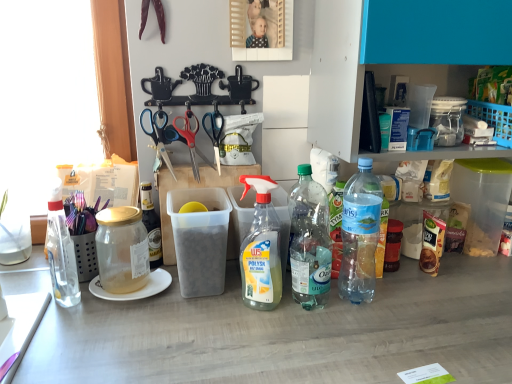
Question: Is clear plastic bottle at center, which appears as the 3th bottle when viewed from the right, in contact with red plastic scissors at center, which is the 2th scissors from right to left?

Choices:
 (A) no
 (B) yes

Answer: (A)

Question: Is clear plastic bottle at center, the 3th bottle in the left-to-right sequence, shorter than red plastic scissors at center, which is the second scissors from left to right?

Choices:
 (A) no
 (B) yes

Answer: (A)

Question: Considering the relative sizes of clear plastic bottle at center, the 3th bottle in the left-to-right sequence, and red plastic scissors at center, which is the 2th scissors from right to left, in the image provided, is clear plastic bottle at center, the 3th bottle in the left-to-right sequence, taller than red plastic scissors at center, which is the 2th scissors from right to left,?

Choices:
 (A) no
 (B) yes

Answer: (B)

Question: Are clear plastic bottle at center, the 3th bottle in the left-to-right sequence, and red plastic scissors at center, which is the second scissors from left to right, far apart?

Choices:
 (A) yes
 (B) no

Answer: (B)

Question: Is clear plastic bottle at center, which appears as the 3th bottle when viewed from the right, positioned beyond the bounds of red plastic scissors at center, which is the 2th scissors from right to left?

Choices:
 (A) yes
 (B) no

Answer: (A)

Question: From the image's perspective, is black plastic scissors at center, placed as the 3th scissors when sorted from left to right, located above or below white ceramic plate at left?

Choices:
 (A) below
 (B) above

Answer: (B)

Question: Considering the positions of point (x=219, y=137) and point (x=152, y=289), is point (x=219, y=137) closer or farther from the camera than point (x=152, y=289)?

Choices:
 (A) farther
 (B) closer

Answer: (A)

Question: Is black plastic scissors at center, the first scissors in the right-to-left sequence, inside or outside of white ceramic plate at left?

Choices:
 (A) inside
 (B) outside

Answer: (B)

Question: Looking at their shapes, would you say black plastic scissors at center, placed as the 3th scissors when sorted from left to right, is wider or thinner than white ceramic plate at left?

Choices:
 (A) thin
 (B) wide

Answer: (A)

Question: Considering the positions of point (97, 276) and point (137, 215), is point (97, 276) closer or farther from the camera than point (137, 215)?

Choices:
 (A) closer
 (B) farther

Answer: (B)

Question: From the image's perspective, is white ceramic plate at left positioned above or below transparent glass jar at left, which ranks as the fourth bottle in right-to-left order?

Choices:
 (A) above
 (B) below

Answer: (B)

Question: Is white ceramic plate at left spatially inside transparent glass jar at left, marked as the second bottle in a left-to-right arrangement, or outside of it?

Choices:
 (A) inside
 (B) outside

Answer: (B)

Question: Considering the positions of white ceramic plate at left and transparent glass jar at left, marked as the second bottle in a left-to-right arrangement, in the image, is white ceramic plate at left bigger or smaller than transparent glass jar at left, marked as the second bottle in a left-to-right arrangement,?

Choices:
 (A) small
 (B) big

Answer: (A)

Question: Considering the positions of point (342, 256) and point (70, 286), is point (342, 256) closer or farther from the camera than point (70, 286)?

Choices:
 (A) closer
 (B) farther

Answer: (B)

Question: From a real-world perspective, is clear plastic bottle at center-right, marked as the 5th bottle in a left-to-right arrangement, above or below clear glass bottle at left, the fifth bottle in the right-to-left sequence?

Choices:
 (A) below
 (B) above

Answer: (B)